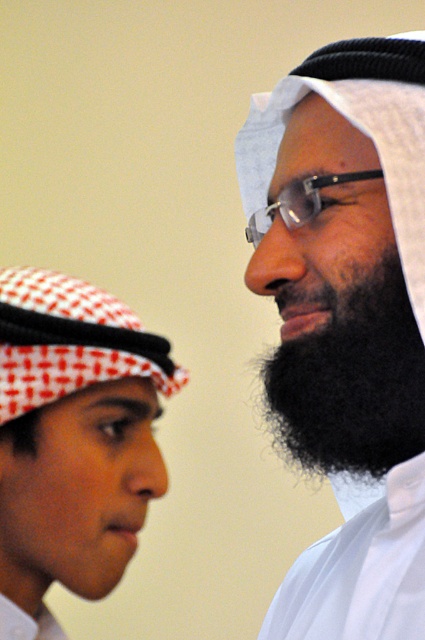
Question: Does white checkered headscarf at left have a smaller size compared to black fuzzy beard at right?

Choices:
 (A) no
 (B) yes

Answer: (A)

Question: Is black matte beard at center positioned in front of black fuzzy beard at right?

Choices:
 (A) no
 (B) yes

Answer: (B)

Question: Can you confirm if white checkered headscarf at left is smaller than black fuzzy beard at right?

Choices:
 (A) no
 (B) yes

Answer: (A)

Question: Among these objects, which one is nearest to the camera?

Choices:
 (A) white checkered headscarf at left
 (B) black fuzzy beard at right

Answer: (A)

Question: Based on their relative distances, which object is nearer to the black fuzzy beard at right?

Choices:
 (A) black matte beard at center
 (B) white checkered headscarf at left

Answer: (A)

Question: Which of the following is the closest to the observer?

Choices:
 (A) (379, 428)
 (B) (266, 150)

Answer: (A)